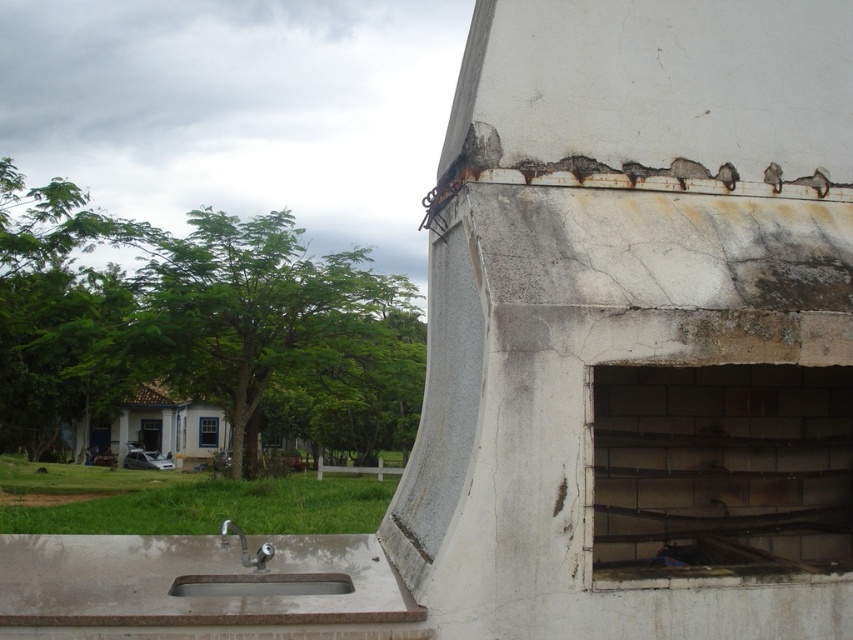
Question: Among these points, which one is farthest from the camera?

Choices:
 (A) (764, 179)
 (B) (596, 58)
 (C) (280, 584)

Answer: (A)

Question: Is rusty metal sink at lower left bigger than rusty metal bird at upper right?

Choices:
 (A) yes
 (B) no

Answer: (A)

Question: Which object is positioned farthest from the rusty metal bird at upper right?

Choices:
 (A) silver metallic faucet at lower center
 (B) white concrete exhaust hood at upper right
 (C) rusty metal sink at lower left

Answer: (A)

Question: Which object is closer to the camera taking this photo?

Choices:
 (A) white concrete exhaust hood at upper right
 (B) silver metallic faucet at lower center
 (C) rusty metal bird at upper right
 (D) rustic concrete sink at lower left

Answer: (A)

Question: Is white concrete exhaust hood at upper right bigger than silver metallic faucet at lower center?

Choices:
 (A) yes
 (B) no

Answer: (B)

Question: Is rustic concrete sink at lower left positioned at the back of rusty metal bird at upper right?

Choices:
 (A) no
 (B) yes

Answer: (A)